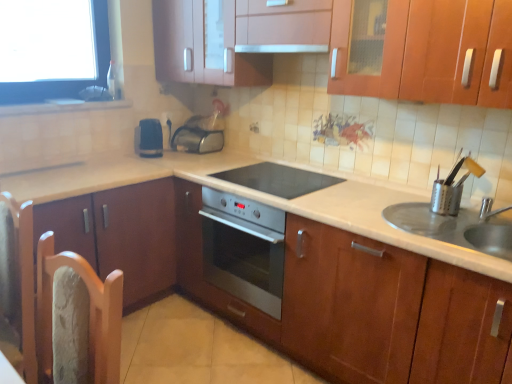
Where is `free space on the front side of metallic silver utensil holder at right, the 3th appliance when ordered from top to bottom`? free space on the front side of metallic silver utensil holder at right, the 3th appliance when ordered from top to bottom is located at coordinates (464, 224).